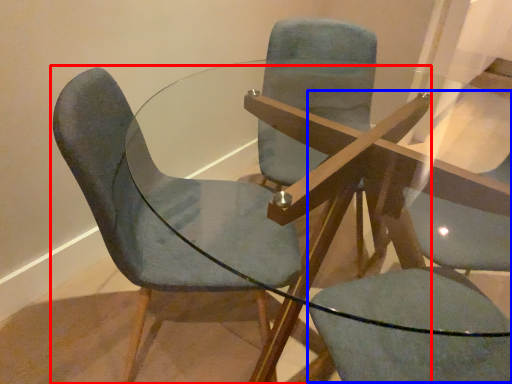
Question: Which object appears closest to the camera in this image, chair (highlighted by a red box) or swivel chair (highlighted by a blue box)?

Choices:
 (A) chair
 (B) swivel chair

Answer: (B)